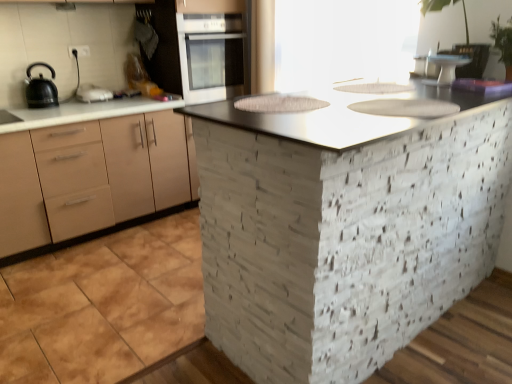
Find the location of a particular element. The width and height of the screenshot is (512, 384). free area below matte black kettle at left (from a real-world perspective) is located at coordinates (96, 97).